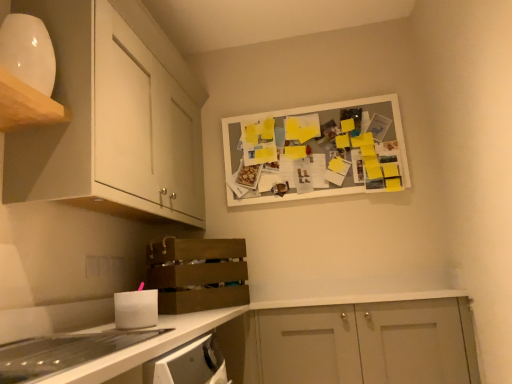
Question: In the image, is clear plastic drawer at lower left positioned in front of or behind brown wooden crate at lower left?

Choices:
 (A) behind
 (B) front

Answer: (B)

Question: From a real-world perspective, is clear plastic drawer at lower left positioned above or below brown wooden crate at lower left?

Choices:
 (A) below
 (B) above

Answer: (A)

Question: Estimate the real-world distances between objects in this image. Which object is farther from the white matte cabinet doors at lower right, arranged as the 1th cabinetry when ordered from the bottom?

Choices:
 (A) white matte cabinet at upper left, which ranks as the second cabinetry in bottom-to-top order
 (B) brown wooden crate at lower left
 (C) clear plastic drawer at lower left
 (D) white matte bulletin board at upper center
 (E) white glossy cabinet at upper left, marked as the third cabinetry in a bottom-to-top arrangement

Answer: (E)

Question: Estimate the real-world distances between objects in this image. Which object is closer to the brown wooden crate at lower left?

Choices:
 (A) white matte cabinet at upper left, which appears as the 2th cabinetry when viewed from the top
 (B) white glossy cabinet at upper left, marked as the third cabinetry in a bottom-to-top arrangement
 (C) clear plastic drawer at lower left
 (D) white matte cabinet doors at lower right, placed as the third cabinetry when sorted from top to bottom
 (E) white matte bulletin board at upper center

Answer: (A)